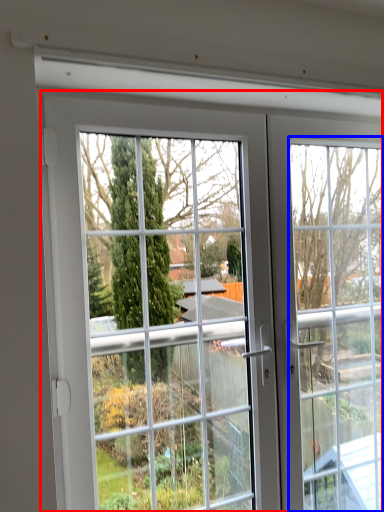
Question: Which of the following is the farthest to the observer, door (highlighted by a red box) or window frame (highlighted by a blue box)?

Choices:
 (A) door
 (B) window frame

Answer: (B)